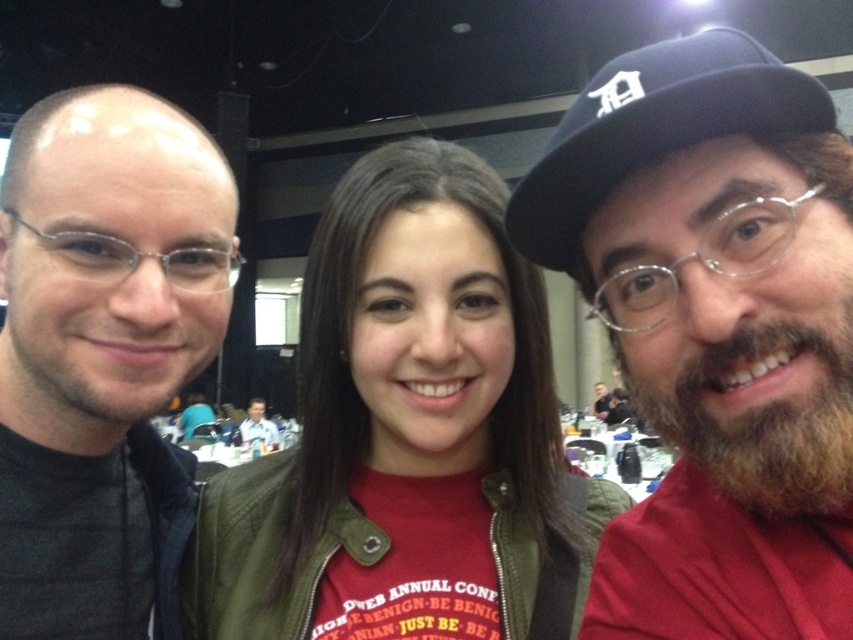
Question: Which point is closer to the camera taking this photo?

Choices:
 (A) (785, 525)
 (B) (262, 422)
 (C) (350, 513)

Answer: (A)

Question: Is bearded man at right wider than smooth skin face at center?

Choices:
 (A) yes
 (B) no

Answer: (B)

Question: Can you confirm if bearded man at right is positioned above smooth skin face at center?

Choices:
 (A) yes
 (B) no

Answer: (A)

Question: Which of the following is the farthest from the observer?

Choices:
 (A) smooth skin face at center
 (B) bearded man at right
 (C) matte black jacket at left

Answer: (A)

Question: Which point is closer to the camera taking this photo?

Choices:
 (A) (630, 88)
 (B) (45, 371)

Answer: (A)

Question: Is matte black jacket at left to the right of smooth skin face at center from the viewer's perspective?

Choices:
 (A) yes
 (B) no

Answer: (A)